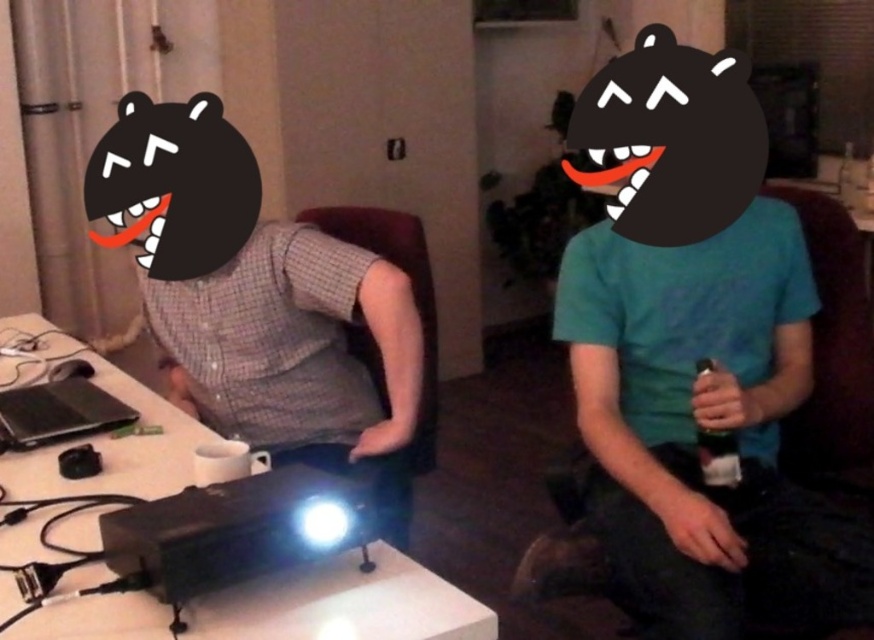
Can you confirm if gray checkered shirt at center is smaller than white glossy projector at center?

Indeed, gray checkered shirt at center has a smaller size compared to white glossy projector at center.

From the picture: Does gray checkered shirt at center come behind white glossy projector at center?

Yes, gray checkered shirt at center is behind white glossy projector at center.

At what (x,y) coordinates should I click in order to perform the action: click on gray checkered shirt at center. Please return your answer as a coordinate pair (x, y). Looking at the image, I should click on (258, 301).

Is white glossy projector at center to the right of black plastic bottle at right from the viewer's perspective?

No, white glossy projector at center is not to the right of black plastic bottle at right.

Who is more distant from viewer, (47, 627) or (706, 433)?

Positioned behind is point (706, 433).

You are a GUI agent. You are given a task and a screenshot of the screen. Output one action in this format:
    pyautogui.click(x=<x>, y=<y>)
    Task: Click on the white glossy projector at center
    Image resolution: width=874 pixels, height=640 pixels.
    Given the screenshot: What is the action you would take?
    pyautogui.click(x=345, y=605)

Can you confirm if gray checkered shirt at center is positioned below black plastic bottle at right?

Actually, gray checkered shirt at center is above black plastic bottle at right.

At what (x,y) coordinates should I click in order to perform the action: click on gray checkered shirt at center. Please return your answer as a coordinate pair (x, y). Looking at the image, I should click on (258, 301).

Identify the location of gray checkered shirt at center. (258, 301).